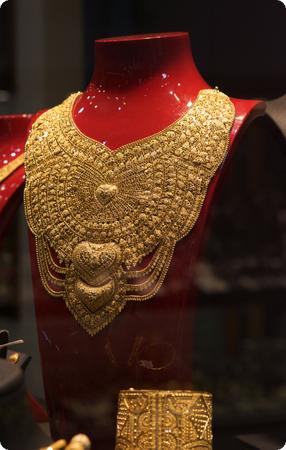
You are a GUI agent. You are given a task and a screenshot of the screen. Output one action in this format:
    pyautogui.click(x=<x>, y=<y>)
    Task: Click on the mannequin
    
    Given the screenshot: What is the action you would take?
    pyautogui.click(x=159, y=321), pyautogui.click(x=16, y=126), pyautogui.click(x=283, y=119)